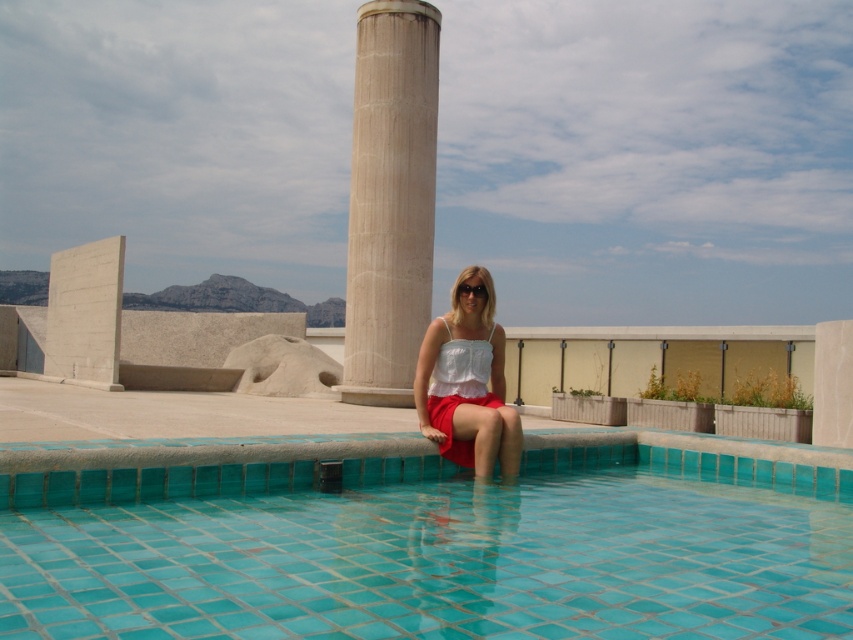
Question: Which point is closer to the camera?

Choices:
 (A) (381, 24)
 (B) (462, 396)

Answer: (B)

Question: Considering the real-world distances, which object is farthest from the turquoise tile swimming pool at lower center?

Choices:
 (A) white satin blouse at center
 (B) matte black sunglasses at center

Answer: (B)

Question: Which of these objects is positioned farthest from the beige marble pillar at center?

Choices:
 (A) matte black sunglasses at center
 (B) turquoise tile swimming pool at lower center
 (C) white satin blouse at center

Answer: (B)

Question: Can you confirm if turquoise tile swimming pool at lower center is positioned above matte black sunglasses at center?

Choices:
 (A) no
 (B) yes

Answer: (A)

Question: Is turquoise tile swimming pool at lower center closer to camera compared to matte black sunglasses at center?

Choices:
 (A) no
 (B) yes

Answer: (B)

Question: Is beige marble pillar at center bigger than matte black sunglasses at center?

Choices:
 (A) no
 (B) yes

Answer: (B)